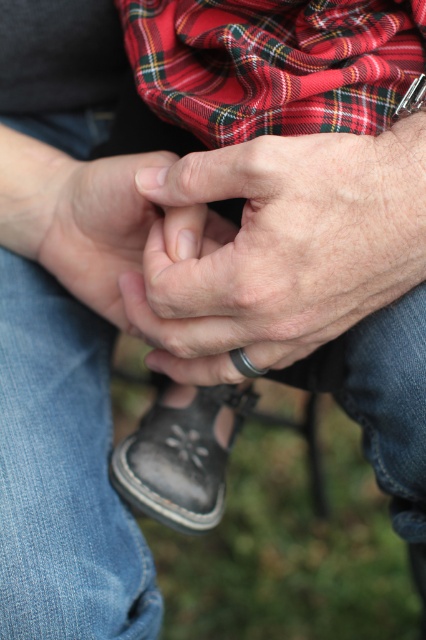
You are a fashion designer observing the image. You notice the leather ring at center and the red plaid scarf at upper center. Which item is closer to the viewer?

The leather ring at center is closer to the viewer because it is in front of the red plaid scarf at upper center.

You are a jeweler examining two items in the image. You see a leather ring at center and a smooth skin hand at center. Which item has a greater height?

The leather ring at center is taller than the smooth skin hand at center.